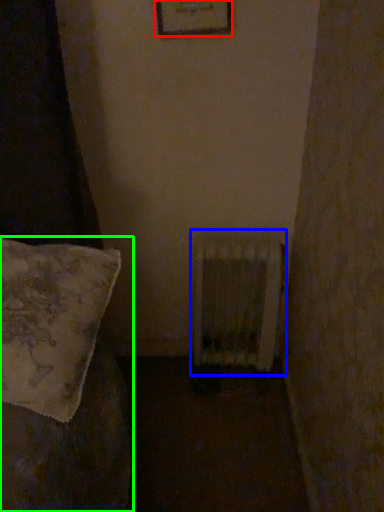
Question: Which object is positioned farthest from picture frame (highlighted by a red box)? Select from radiator (highlighted by a blue box) and furniture (highlighted by a green box).

Choices:
 (A) radiator
 (B) furniture

Answer: (B)